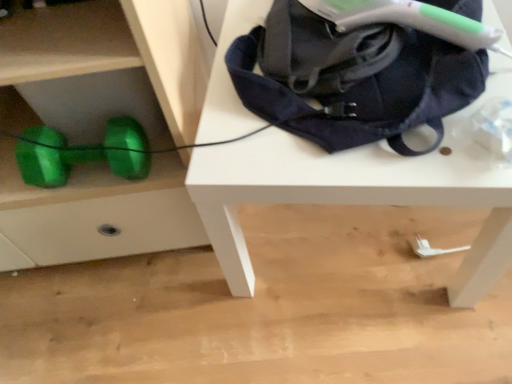
Question: Looking at the image, does green metallic dumbbell at lower left seem bigger or smaller compared to white matte table at upper center?

Choices:
 (A) big
 (B) small

Answer: (B)

Question: Based on their positions, is green metallic dumbbell at lower left located to the left or right of white matte table at upper center?

Choices:
 (A) right
 (B) left

Answer: (B)

Question: Which of these objects is positioned farthest from the navy blue fabric bag at upper right?

Choices:
 (A) green metallic dumbbell at lower left
 (B) green shiny dumbbell at lower left
 (C) white matte table at upper center

Answer: (A)

Question: Which object is the closest to the white matte table at upper center?

Choices:
 (A) green metallic dumbbell at lower left
 (B) navy blue fabric bag at upper right
 (C) green shiny dumbbell at lower left

Answer: (B)